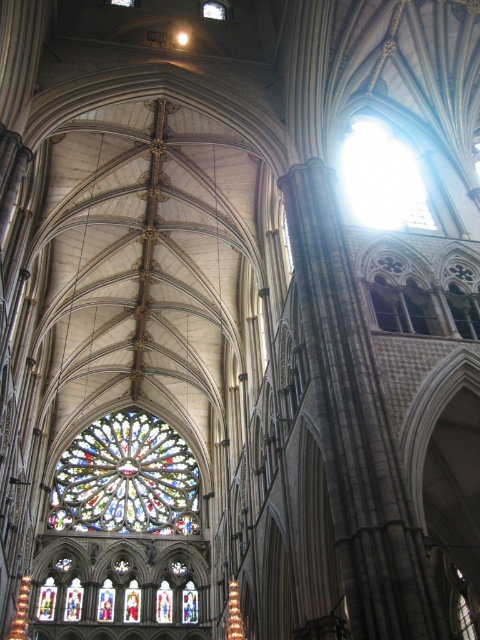
Question: Does multicolored stained glass at center appear over transparent glass at upper center?

Choices:
 (A) yes
 (B) no

Answer: (B)

Question: Does multicolored stained glass at center have a greater width compared to transparent glass at upper center?

Choices:
 (A) yes
 (B) no

Answer: (A)

Question: Which point appears farthest from the camera in this image?

Choices:
 (A) [x=52, y=518]
 (B) [x=382, y=132]

Answer: (A)

Question: Which point appears closest to the camera in this image?

Choices:
 (A) (x=144, y=476)
 (B) (x=367, y=147)

Answer: (B)

Question: Does multicolored stained glass at center appear under transparent glass at upper center?

Choices:
 (A) no
 (B) yes

Answer: (B)